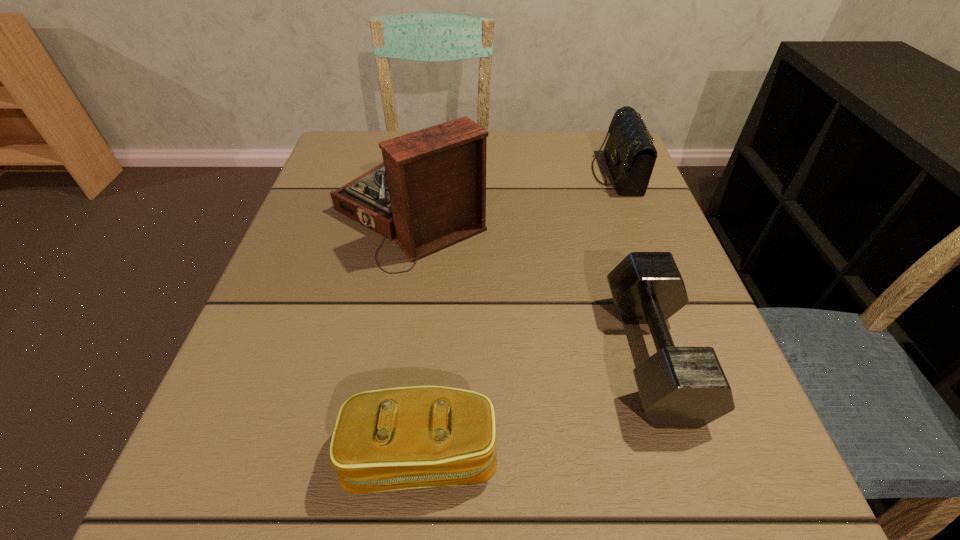
The height and width of the screenshot is (540, 960). In order to click on free point at the near edge in this screenshot , I will do `click(595, 524)`.

I want to click on free space at the left edge of the desktop, so click(x=291, y=239).

Where is `vacant space at the right edge of the desktop`? The height and width of the screenshot is (540, 960). vacant space at the right edge of the desktop is located at coordinates (618, 360).

The height and width of the screenshot is (540, 960). Identify the location of free location at the far left corner. (379, 150).

Where is `free region at the near right corner of the desktop`? This screenshot has height=540, width=960. free region at the near right corner of the desktop is located at coordinates (640, 461).

You are a GUI agent. You are given a task and a screenshot of the screen. Output one action in this format:
    pyautogui.click(x=<x>, y=<y>)
    Task: Click on the vacant region between the taller clutch bag and the phonograph record
    The width and height of the screenshot is (960, 540).
    Given the screenshot: What is the action you would take?
    pyautogui.click(x=514, y=193)

This screenshot has height=540, width=960. I want to click on vacant area that lies between the left clutch bag and the phonograph record, so click(417, 334).

You are a GUI agent. You are given a task and a screenshot of the screen. Output one action in this format:
    pyautogui.click(x=<x>, y=<y>)
    Task: Click on the unoccupied area between the right clutch bag and the phonograph record
    This screenshot has height=540, width=960.
    Given the screenshot: What is the action you would take?
    pyautogui.click(x=514, y=193)

Image resolution: width=960 pixels, height=540 pixels. Identify the location of free area in between the tallest object and the dumbbell. (532, 284).

Locate an element on the screen. The width and height of the screenshot is (960, 540). free space between the right clutch bag and the phonograph record is located at coordinates (514, 193).